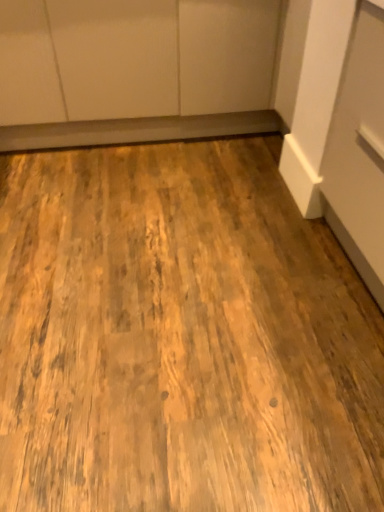
I want to click on natural wood floor at center, so click(x=181, y=337).

Measure the distance between natural wood floor at center and camera.

A distance of 1.06 meters exists between natural wood floor at center and camera.

What do you see at coordinates (181, 337) in the screenshot?
I see `natural wood floor at center` at bounding box center [181, 337].

In order to face matte white cabinetry at upper center, should I rotate leftwards or rightwards?

A 7.826 degree turn to the left will do.

Locate an element on the screen. The image size is (384, 512). matte white cabinetry at upper center is located at coordinates (135, 70).

What do you see at coordinates (135, 70) in the screenshot? The width and height of the screenshot is (384, 512). I see `matte white cabinetry at upper center` at bounding box center [135, 70].

This screenshot has width=384, height=512. I want to click on natural wood floor at center, so click(x=181, y=337).

Considering the relative positions of matte white cabinetry at upper center and natural wood floor at center in the image provided, is matte white cabinetry at upper center to the right of natural wood floor at center from the viewer's perspective?

No, matte white cabinetry at upper center is not to the right of natural wood floor at center.

Considering the relative positions of matte white cabinetry at upper center and natural wood floor at center in the image provided, is matte white cabinetry at upper center in front of natural wood floor at center?

No, it is not.

Between point (23, 138) and point (6, 253), which one is positioned in front?

The point (6, 253) is closer to the camera.

From the image's perspective, does matte white cabinetry at upper center appear higher than natural wood floor at center?

Indeed, from the image's perspective, matte white cabinetry at upper center is shown above natural wood floor at center.

From a real-world perspective, is matte white cabinetry at upper center on natural wood floor at center?

Yes, from a real-world perspective, matte white cabinetry at upper center is over natural wood floor at center

Which of these two, matte white cabinetry at upper center or natural wood floor at center, is wider?

natural wood floor at center.

Considering the relative sizes of matte white cabinetry at upper center and natural wood floor at center in the image provided, is matte white cabinetry at upper center shorter than natural wood floor at center?

In fact, matte white cabinetry at upper center may be taller than natural wood floor at center.

In the scene shown: Considering the relative sizes of matte white cabinetry at upper center and natural wood floor at center in the image provided, is matte white cabinetry at upper center smaller than natural wood floor at center?

No.

Would you say matte white cabinetry at upper center is inside or outside natural wood floor at center?

matte white cabinetry at upper center lies outside natural wood floor at center.

Would you consider matte white cabinetry at upper center to be distant from natural wood floor at center?

No, matte white cabinetry at upper center is not far away from natural wood floor at center.

Is matte white cabinetry at upper center oriented towards natural wood floor at center?

Yes.

How far apart are matte white cabinetry at upper center and natural wood floor at center?

The distance of matte white cabinetry at upper center from natural wood floor at center is 39.26 inches.

Find the location of a particular element. plywood on the right of matte white cabinetry at upper center is located at coordinates (181, 337).

Looking at this image, is natural wood floor at center at the right side of matte white cabinetry at upper center?

Yes, natural wood floor at center is to the right of matte white cabinetry at upper center.

In the scene shown: Does natural wood floor at center come behind matte white cabinetry at upper center?

That is False.

Considering the positions of point (28, 493) and point (124, 59), is point (28, 493) closer or farther from the camera than point (124, 59)?

Clearly, point (28, 493) is closer to the camera than point (124, 59).

From the image's perspective, which is above, natural wood floor at center or matte white cabinetry at upper center?

matte white cabinetry at upper center.

From a real-world perspective, who is located higher, natural wood floor at center or matte white cabinetry at upper center?

matte white cabinetry at upper center, from a real-world perspective.

Considering the sizes of natural wood floor at center and matte white cabinetry at upper center in the image, is natural wood floor at center wider or thinner than matte white cabinetry at upper center?

natural wood floor at center is wider than matte white cabinetry at upper center.

Considering the sizes of natural wood floor at center and matte white cabinetry at upper center in the image, is natural wood floor at center taller or shorter than matte white cabinetry at upper center?

Considering their sizes, natural wood floor at center has less height than matte white cabinetry at upper center.

Between natural wood floor at center and matte white cabinetry at upper center, which one has smaller size?

Smaller between the two is natural wood floor at center.

Looking at this image, is natural wood floor at center surrounding matte white cabinetry at upper center?

Definitely not — matte white cabinetry at upper center is not inside natural wood floor at center.

Is natural wood floor at center beside matte white cabinetry at upper center?

No, natural wood floor at center is not making contact with matte white cabinetry at upper center.

Does natural wood floor at center turn towards matte white cabinetry at upper center?

No, natural wood floor at center does not turn towards matte white cabinetry at upper center.

You are a GUI agent. You are given a task and a screenshot of the screen. Output one action in this format:
    pyautogui.click(x=<x>, y=<y>)
    Task: Click on the plywood on the right of matte white cabinetry at upper center
    Image resolution: width=384 pixels, height=512 pixels.
    Given the screenshot: What is the action you would take?
    pyautogui.click(x=181, y=337)

Where is `plywood that is under the matte white cabinetry at upper center (from a real-world perspective)`? Image resolution: width=384 pixels, height=512 pixels. plywood that is under the matte white cabinetry at upper center (from a real-world perspective) is located at coordinates (181, 337).

Locate an element on the screen. cabinetry lying above the natural wood floor at center (from the image's perspective) is located at coordinates (135, 70).